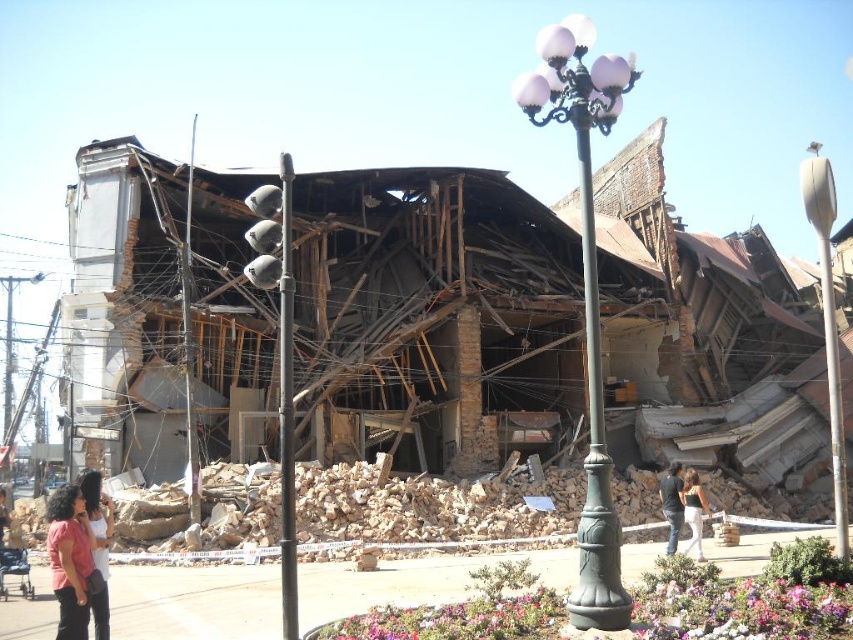
Is point (839, 420) in front of point (189, 288)?

Yes, it is.

How much distance is there between metallic pole at right and metallic gray pole at center?

metallic pole at right and metallic gray pole at center are 46.54 meters apart from each other.

Between point (830, 225) and point (183, 316), which one is positioned in front?

Positioned in front is point (830, 225).

Where is `metallic pole at right`? The height and width of the screenshot is (640, 853). metallic pole at right is located at coordinates (833, 392).

Is point (595, 312) positioned in front of point (190, 131)?

Yes, it is.

Who is lower down, green metal pole at center or metallic gray pole at center?

metallic gray pole at center is below.

Who is more distant from viewer, (x=599, y=467) or (x=192, y=332)?

Positioned behind is point (x=192, y=332).

This screenshot has width=853, height=640. I want to click on green metal pole at center, so click(585, 292).

Is metallic pole at right positioned at the back of dark blue jeans at center?

No, it is in front of dark blue jeans at center.

Between point (833, 458) and point (669, 484), which one is positioned behind?

The point (833, 458) is more distant.

Where is `metallic pole at right`? This screenshot has height=640, width=853. metallic pole at right is located at coordinates (833, 392).